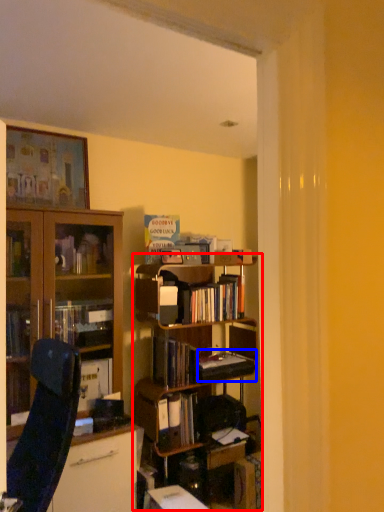
Question: Among these objects, which one is farthest to the camera, bookcase (highlighted by a red box) or paperback book (highlighted by a blue box)?

Choices:
 (A) bookcase
 (B) paperback book

Answer: (B)